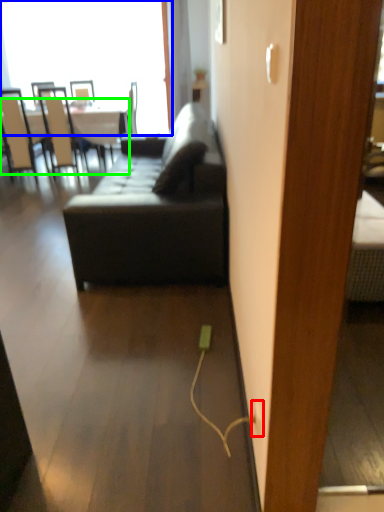
Question: Based on their relative distances, which object is nearer to electric outlet (highlighted by a red box)? Choose from window (highlighted by a blue box) and table (highlighted by a green box).

Choices:
 (A) window
 (B) table

Answer: (B)